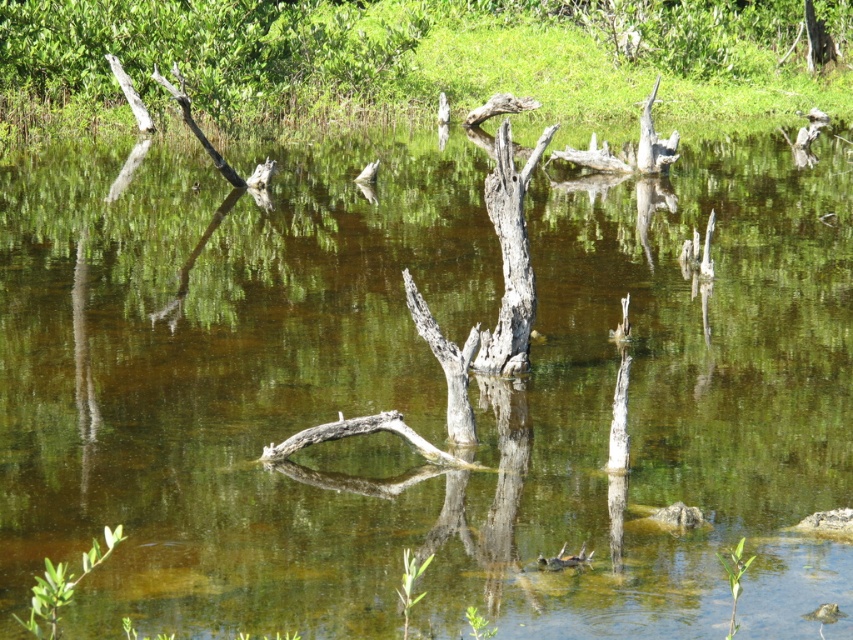
Question: Among these objects, which one is farthest from the camera?

Choices:
 (A) smooth brown tree trunk at upper left
 (B) dead wood at upper center
 (C) gray rough tree trunk at center

Answer: (A)

Question: Which point is farther to the camera?

Choices:
 (A) click(550, 129)
 (B) click(7, 61)
 (C) click(758, 54)

Answer: (C)

Question: Among these points, which one is nearest to the camera?

Choices:
 (A) (486, 54)
 (B) (527, 168)
 (C) (233, 118)

Answer: (B)

Question: Can you confirm if smooth brown tree trunk at upper left is thinner than gray rough tree trunk at center?

Choices:
 (A) no
 (B) yes

Answer: (A)

Question: Does smooth brown tree trunk at upper left have a greater width compared to gray rough tree trunk at center?

Choices:
 (A) no
 (B) yes

Answer: (B)

Question: Considering the relative positions of dead wood at upper center and smooth brown tree trunk at upper left in the image provided, where is dead wood at upper center located with respect to smooth brown tree trunk at upper left?

Choices:
 (A) right
 (B) left

Answer: (A)